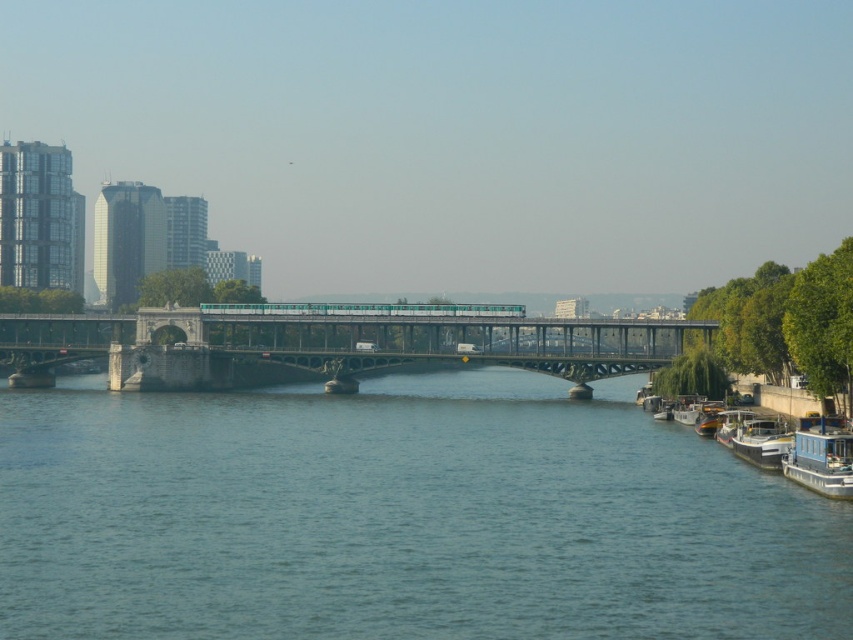
Question: Which object is closer to the camera taking this photo?

Choices:
 (A) white wooden boat at right
 (B) blue water at center
 (C) wooden polished boat at right

Answer: (B)

Question: Is blue water at center above green metallic bridge at center?

Choices:
 (A) yes
 (B) no

Answer: (B)

Question: Is blue water at center below metallic blue boat at lower right?

Choices:
 (A) no
 (B) yes

Answer: (B)

Question: Is green metallic bridge at center above wooden polished boat at right?

Choices:
 (A) no
 (B) yes

Answer: (B)

Question: Which point is closer to the camera?

Choices:
 (A) white glossy boat at lower right
 (B) blue painted wood boat at lower right
 (C) metallic blue boat at lower right
 (D) blue water at center

Answer: (D)

Question: Which is farther from the white glossy boat at lower right?

Choices:
 (A) wooden polished boat at right
 (B) blue water at center

Answer: (B)